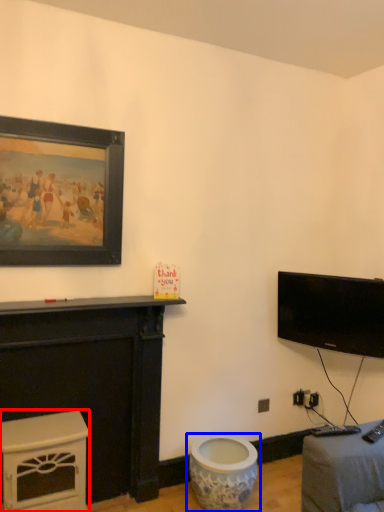
Question: Which point is closer to the camera, furniture (highlighted by a red box) or toilet (highlighted by a blue box)?

Choices:
 (A) furniture
 (B) toilet

Answer: (A)